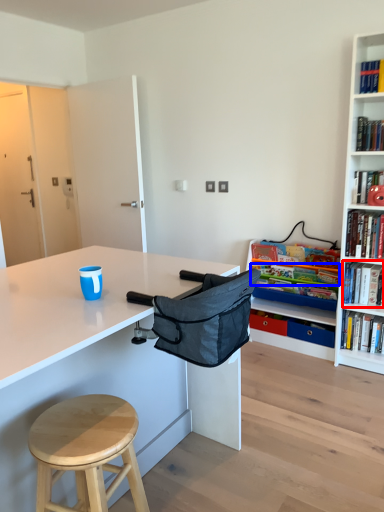
Question: Among these objects, which one is nearest to the camera, book (highlighted by a red box) or book (highlighted by a blue box)?

Choices:
 (A) book
 (B) book

Answer: (A)